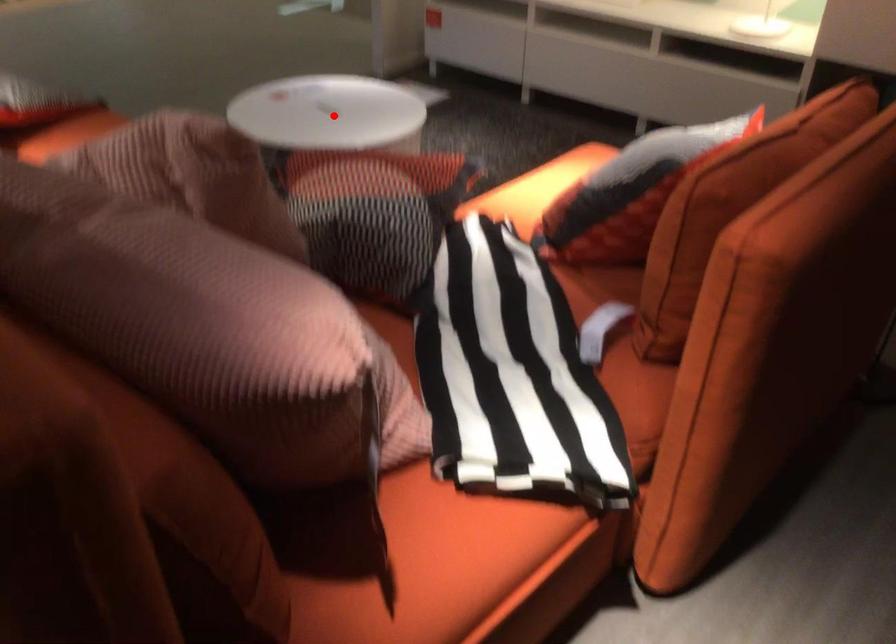
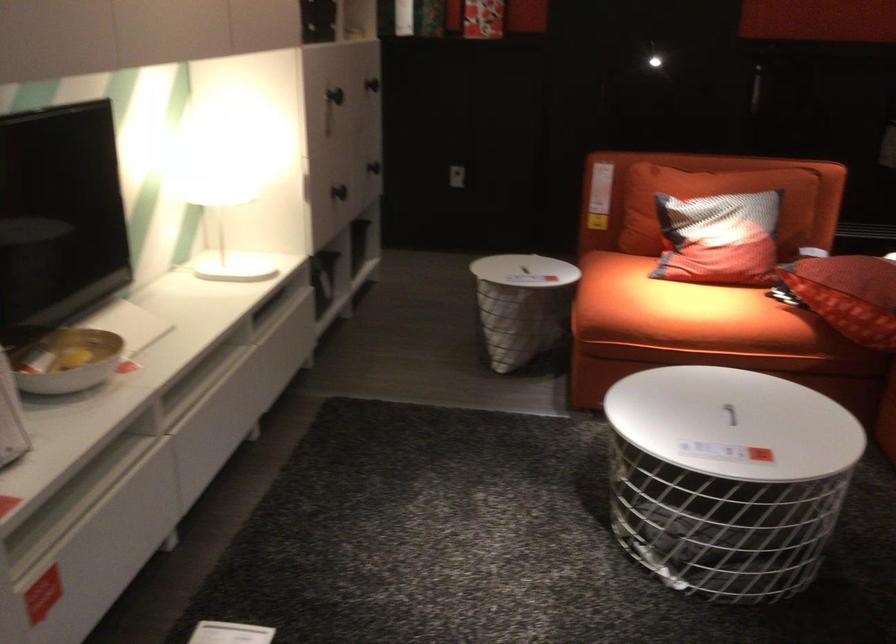
Question: A red point is marked in image1. In image2, is the corresponding 3D point closer to the camera or farther? Reply with the corresponding letter.

Choices:
 (A) The corresponding 3D point is closer.
 (B) The corresponding 3D point is farther.

Answer: (A)